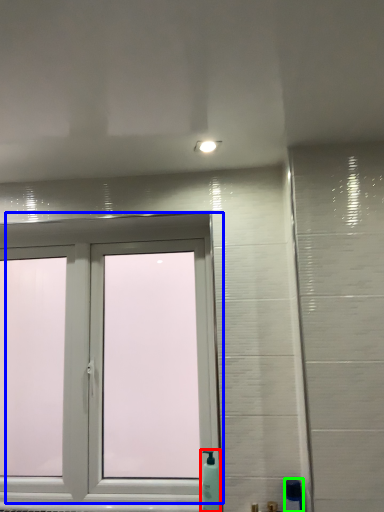
Question: Estimate the real-world distances between objects in this image. Which object is closer to soap dispenser (highlighted by a red box), window (highlighted by a blue box) or soap dispenser (highlighted by a green box)?

Choices:
 (A) window
 (B) soap dispenser

Answer: (B)